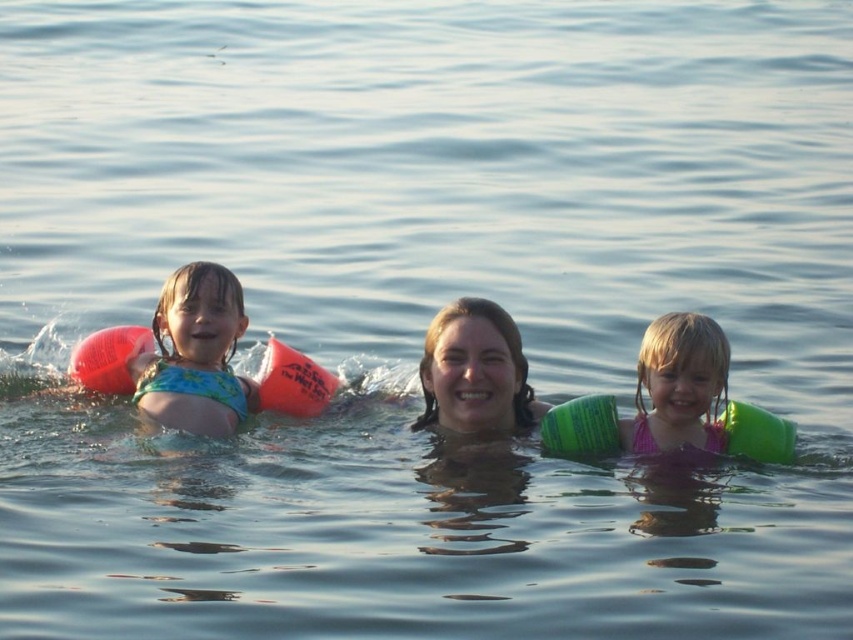
Question: Does blue-green swimsuit at left appear under green rubber arm float at center?

Choices:
 (A) yes
 (B) no

Answer: (B)

Question: Which point is closer to the camera?

Choices:
 (A) (148, 412)
 (B) (646, 339)
 (C) (454, 356)

Answer: (B)

Question: Considering the real-world distances, which object is closest to the blue-green swimsuit at left?

Choices:
 (A) pink fabric swimsuit at center
 (B) green rubber arm float at center

Answer: (B)

Question: Which of the following is the closest to the observer?

Choices:
 (A) pink fabric swimsuit at center
 (B) blue-green swimsuit at left

Answer: (A)

Question: Does blue-green swimsuit at left have a smaller size compared to green rubber arm float at center?

Choices:
 (A) no
 (B) yes

Answer: (B)

Question: Is green rubber arm float at center bigger than pink fabric swimsuit at center?

Choices:
 (A) no
 (B) yes

Answer: (B)